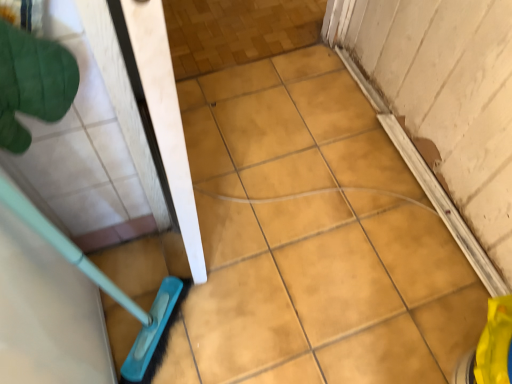
Question: Considering the positions of yellow matte tile at lower right, which appears as the 2th ceramic tile when viewed from the left, and green fabric glove at upper left in the image, is yellow matte tile at lower right, which appears as the 2th ceramic tile when viewed from the left, bigger or smaller than green fabric glove at upper left?

Choices:
 (A) small
 (B) big

Answer: (B)

Question: From a real-world perspective, relative to green fabric glove at upper left, is yellow matte tile at lower right, the first ceramic tile in the right-to-left sequence, vertically above or below?

Choices:
 (A) above
 (B) below

Answer: (B)

Question: Which is farther from the yellow matte tile at lower right, which appears as the 2th ceramic tile when viewed from the left?

Choices:
 (A) yellow matte tile at center, which is counted as the 1th ceramic tile, starting from the left
 (B) green fabric glove at upper left

Answer: (B)

Question: Considering the real-world distances, which object is closest to the yellow matte tile at center, placed as the second ceramic tile when sorted from right to left?

Choices:
 (A) green fabric glove at upper left
 (B) yellow matte tile at lower right, which appears as the 2th ceramic tile when viewed from the left

Answer: (B)